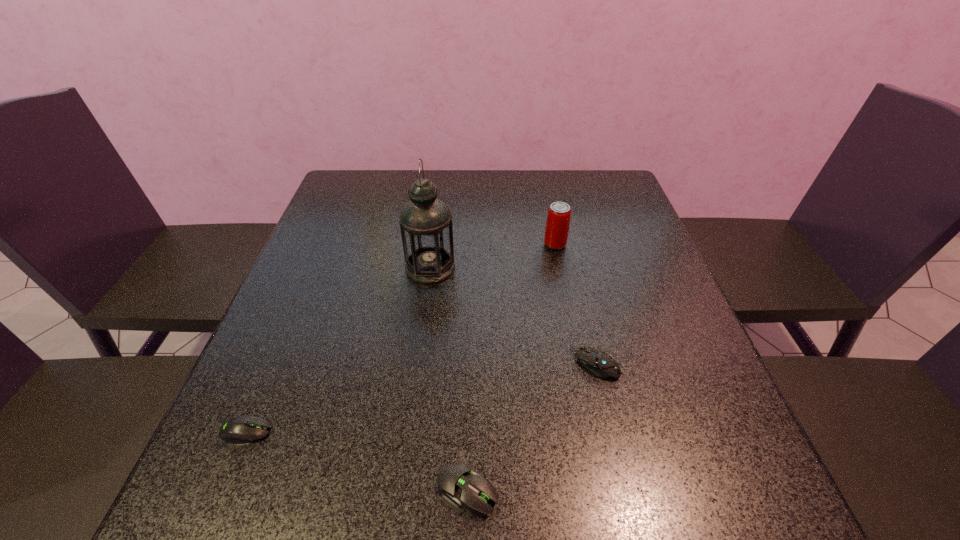
This screenshot has width=960, height=540. Identify the location of free location located on the left of the fourth nearest object. (369, 267).

Identify the location of vacant region located 0.290m on the back of the fourth shortest object. (542, 182).

Where is `vacant point located on the right of the farthest computer mouse`? This screenshot has width=960, height=540. vacant point located on the right of the farthest computer mouse is located at coordinates (689, 363).

The height and width of the screenshot is (540, 960). I want to click on free space located on the wheel side of the fourth farthest object, so click(335, 431).

The width and height of the screenshot is (960, 540). Find the location of `blank space located 0.350m on the right of the nearest computer mouse`. blank space located 0.350m on the right of the nearest computer mouse is located at coordinates (724, 489).

Find the location of a particular element. This screenshot has height=540, width=960. object located in the near edge section of the desktop is located at coordinates (459, 485).

Where is `object that is positioned at the left edge`? This screenshot has width=960, height=540. object that is positioned at the left edge is located at coordinates (243, 429).

Where is `vacant space at the far edge of the desktop`? This screenshot has width=960, height=540. vacant space at the far edge of the desktop is located at coordinates (552, 177).

Locate an element on the screen. Image resolution: width=960 pixels, height=540 pixels. free space at the near edge of the desktop is located at coordinates click(642, 529).

Find the location of a particular element. free location at the left edge of the desktop is located at coordinates (359, 227).